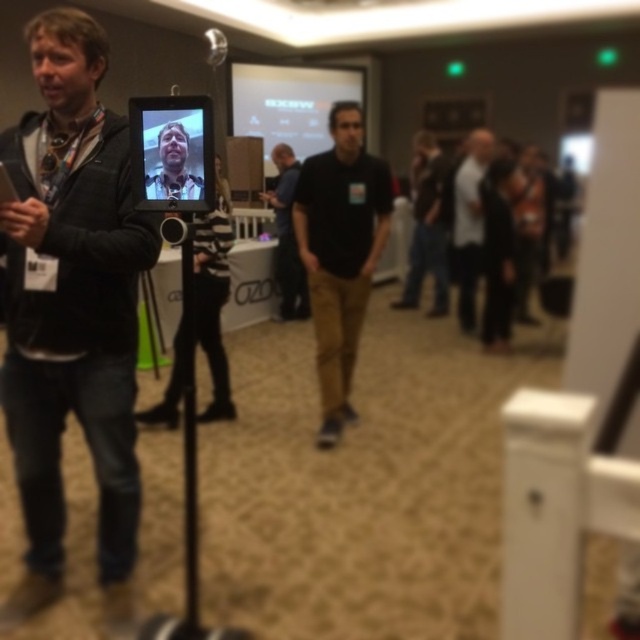
Question: Does matte black jacket at left appear under white matte shirt at center?

Choices:
 (A) yes
 (B) no

Answer: (A)

Question: Can you confirm if matte black tablet at center is positioned to the left of matte black face at center?

Choices:
 (A) no
 (B) yes

Answer: (B)

Question: Which point appears farthest from the camera in this image?

Choices:
 (A) (173, 156)
 (B) (209, 630)
 (C) (332, 196)

Answer: (C)

Question: Where is black plastic tripod at center located in relation to matte black face at center in the image?

Choices:
 (A) below
 (B) above

Answer: (A)

Question: Estimate the real-world distances between objects in this image. Which object is closer to the matte black tablet at center?

Choices:
 (A) matte black face at center
 (B) dark gray shirt at center
 (C) matte black jacket at left

Answer: (A)

Question: Among these objects, which one is farthest from the camera?

Choices:
 (A) black matte shirt at center
 (B) matte black jacket at left
 (C) white matte shirt at center

Answer: (C)